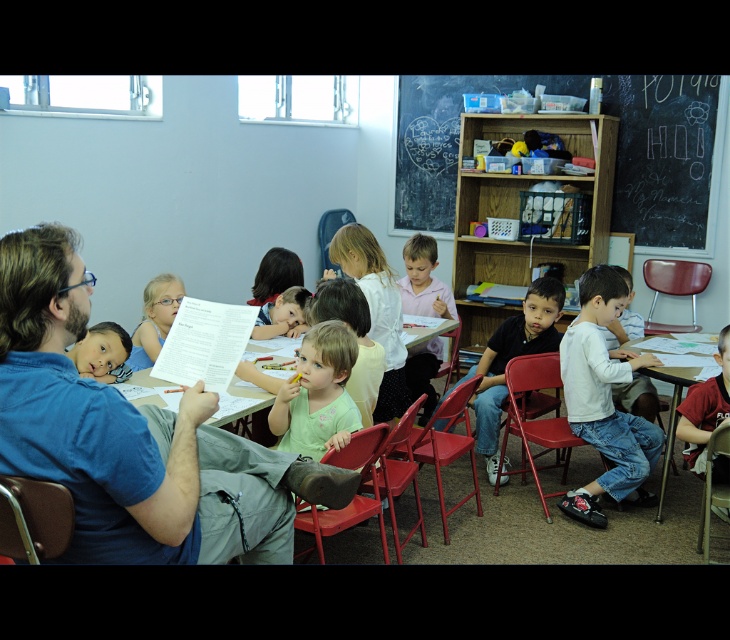
Question: In this image, where is light green fabric shirt at center located relative to smooth skin child at center?

Choices:
 (A) above
 (B) below

Answer: (B)

Question: Which point is closer to the camera?

Choices:
 (A) wooden shelf at upper right
 (B) red shirt at lower right

Answer: (B)

Question: Can you confirm if wooden shelf at upper right is smaller than black matte shirt at center?

Choices:
 (A) no
 (B) yes

Answer: (A)

Question: Among these points, which one is farthest from the camera?

Choices:
 (A) (258, 333)
 (B) (155, 321)
 (C) (715, 353)
 (D) (410, 380)

Answer: (D)

Question: Which of the following is the closest to the observer?

Choices:
 (A) blue cotton shirt at left
 (B) red shirt at lower right
 (C) black matte shirt at center

Answer: (A)

Question: Can you confirm if light green fabric shirt at center is positioned to the left of wooden table at center?

Choices:
 (A) no
 (B) yes

Answer: (B)